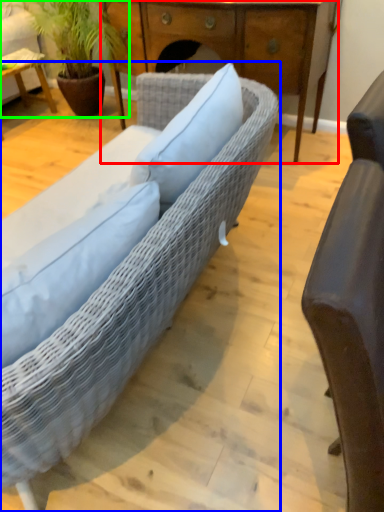
Question: Estimate the real-world distances between objects in this image. Which object is closer to desk (highlighted by a red box), studio couch (highlighted by a blue box) or houseplant (highlighted by a green box)?

Choices:
 (A) studio couch
 (B) houseplant

Answer: (B)